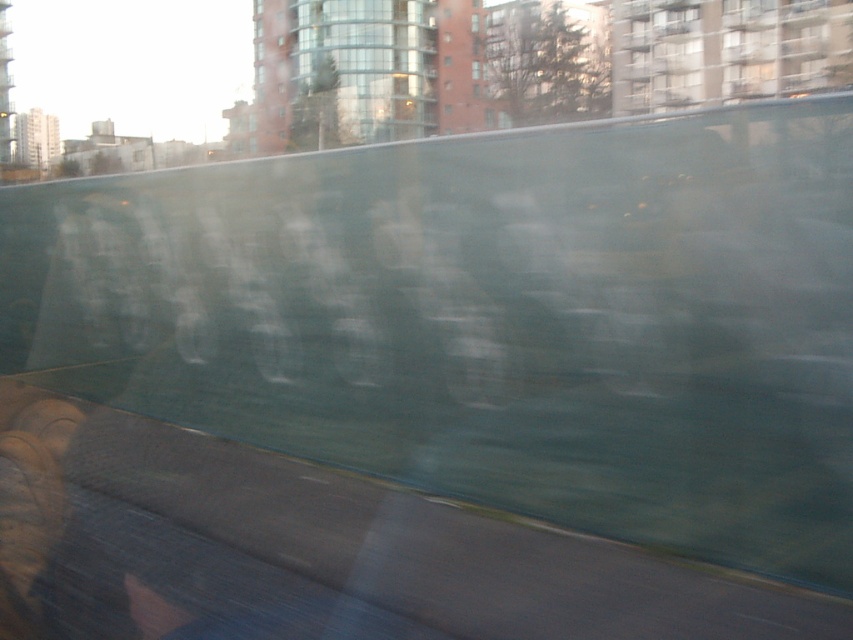
Question: Can you confirm if transparent glass window at upper center is positioned to the right of transparent glass window at center?

Choices:
 (A) yes
 (B) no

Answer: (B)

Question: Which point is farther to the camera?

Choices:
 (A) (479, 17)
 (B) (474, 74)

Answer: (A)

Question: In this image, where is transparent glass window at upper center located relative to transparent glass window at center?

Choices:
 (A) right
 (B) left

Answer: (B)

Question: Can you confirm if transparent glass window at upper center is smaller than transparent glass window at center?

Choices:
 (A) no
 (B) yes

Answer: (A)

Question: Which object appears farthest from the camera in this image?

Choices:
 (A) transparent glass window at center
 (B) transparent glass window at upper center

Answer: (B)